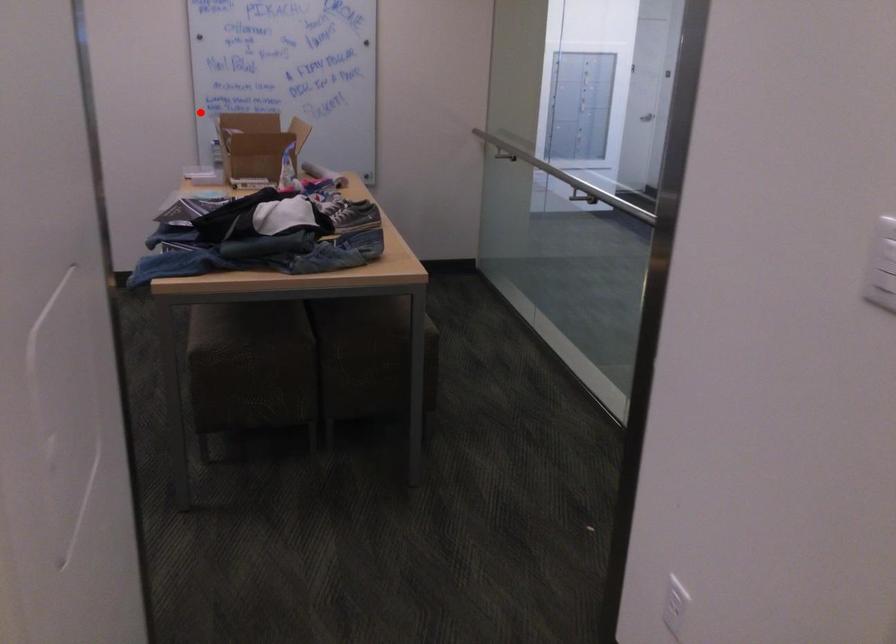
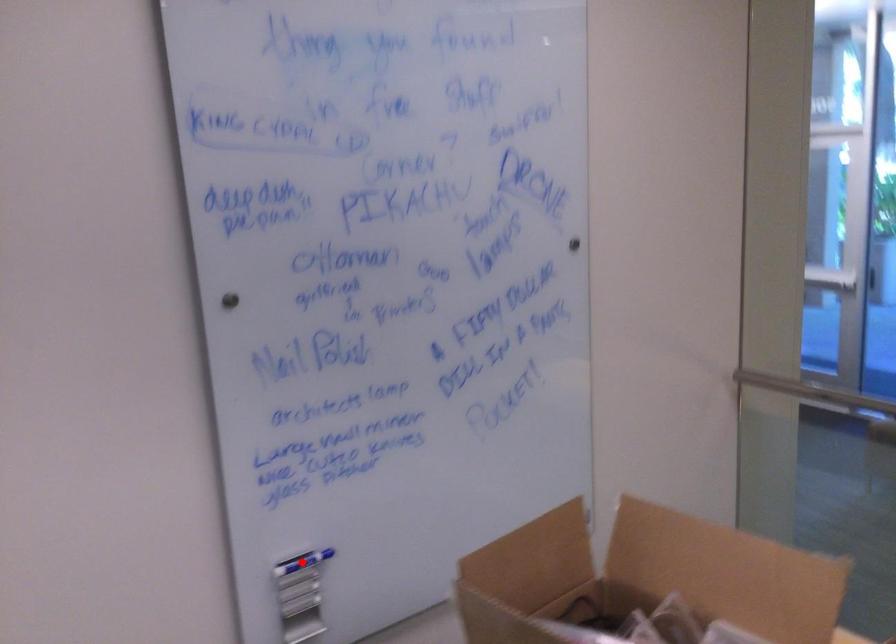
I am providing you with two images of the same scene from different viewpoints. A red point is marked on the first image and another point is marked on the second image. Is the marked point in image1 the same physical position as the marked point in image2?

Yes